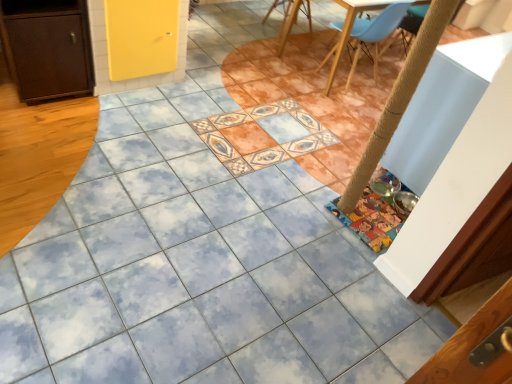
Question: Are brown matte cabinet at left and wooden chair at upper center, which ranks as the 1th chair in left-to-right order, making contact?

Choices:
 (A) yes
 (B) no

Answer: (B)

Question: Are brown matte cabinet at left and wooden chair at upper center, which is the first chair from back to front, far apart?

Choices:
 (A) no
 (B) yes

Answer: (B)

Question: Is brown matte cabinet at left positioned with its back to wooden chair at upper center, which is the first chair from back to front?

Choices:
 (A) yes
 (B) no

Answer: (B)

Question: Does brown matte cabinet at left have a greater height compared to wooden chair at upper center, which appears as the second chair when viewed from the right?

Choices:
 (A) no
 (B) yes

Answer: (B)

Question: Does brown matte cabinet at left lie behind wooden chair at upper center, which is the first chair from back to front?

Choices:
 (A) no
 (B) yes

Answer: (A)

Question: Is brown matte cabinet at left taller or shorter than wooden chair at upper center, the 2th chair positioned from the front?

Choices:
 (A) tall
 (B) short

Answer: (A)

Question: Considering the relative positions of brown matte cabinet at left and wooden chair at upper center, which appears as the second chair when viewed from the right, in the image provided, is brown matte cabinet at left to the left or to the right of wooden chair at upper center, which appears as the second chair when viewed from the right,?

Choices:
 (A) right
 (B) left

Answer: (B)

Question: In the image, is brown matte cabinet at left positioned in front of or behind wooden chair at upper center, which ranks as the 1th chair in left-to-right order?

Choices:
 (A) front
 (B) behind

Answer: (A)

Question: In terms of width, does brown matte cabinet at left look wider or thinner when compared to wooden chair at upper center, which is the first chair from back to front?

Choices:
 (A) thin
 (B) wide

Answer: (A)

Question: Is wooden chair at upper center, which appears as the second chair when viewed from the right, taller or shorter than brown matte cabinet at left?

Choices:
 (A) tall
 (B) short

Answer: (B)

Question: Based on their positions, is wooden chair at upper center, which ranks as the 1th chair in left-to-right order, located to the left or right of brown matte cabinet at left?

Choices:
 (A) right
 (B) left

Answer: (A)

Question: Based on their sizes in the image, would you say wooden chair at upper center, the 2th chair positioned from the front, is bigger or smaller than brown matte cabinet at left?

Choices:
 (A) big
 (B) small

Answer: (B)

Question: Is wooden chair at upper center, which is the first chair from back to front, inside the boundaries of brown matte cabinet at left, or outside?

Choices:
 (A) inside
 (B) outside

Answer: (B)

Question: From their relative heights in the image, would you say light blue plastic chair at upper right, which is the first chair from right to left, is taller or shorter than brown matte cabinet at left?

Choices:
 (A) tall
 (B) short

Answer: (A)

Question: From a real-world perspective, is light blue plastic chair at upper right, which is the first chair from right to left, physically located above or below brown matte cabinet at left?

Choices:
 (A) below
 (B) above

Answer: (B)